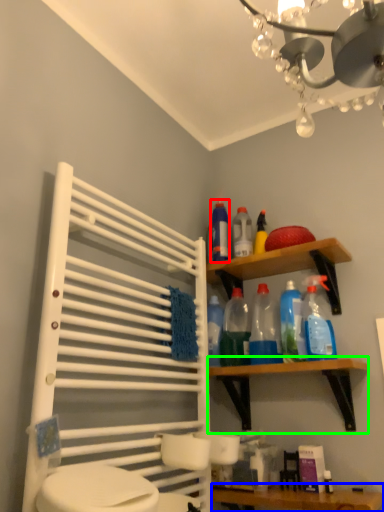
Question: Which object is the closest to the cleaning product (highlighted by a red box)? Choose among these: vanity (highlighted by a blue box) or shelf (highlighted by a green box).

Choices:
 (A) vanity
 (B) shelf

Answer: (B)